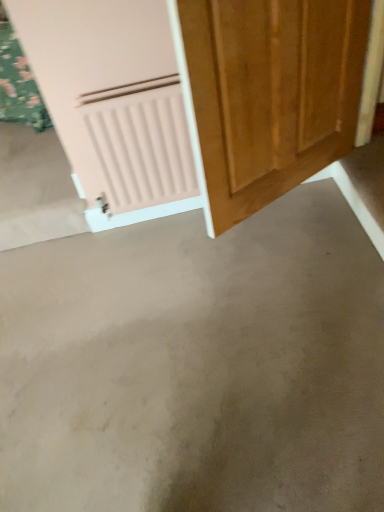
Describe the element at coordinates (196, 365) in the screenshot. This screenshot has height=512, width=384. I see `gray concrete at center` at that location.

Locate an element on the screen. The height and width of the screenshot is (512, 384). gray concrete at center is located at coordinates (196, 365).

The width and height of the screenshot is (384, 512). Find the location of `wooden door at center`. wooden door at center is located at coordinates (91, 58).

Describe the element at coordinates (91, 58) in the screenshot. I see `wooden door at center` at that location.

Identify the location of gray concrete at center. (196, 365).

Can you confirm if gray concrete at center is positioned to the right of wooden door at center?

No, gray concrete at center is not to the right of wooden door at center.

Which is behind, gray concrete at center or wooden door at center?

Positioned behind is gray concrete at center.

Does point (102, 430) come in front of point (82, 177)?

Yes, point (102, 430) is in front of point (82, 177).

From the image's perspective, is gray concrete at center above wooden door at center?

Actually, gray concrete at center appears below wooden door at center in the image.

From a real-world perspective, between gray concrete at center and wooden door at center, who is vertically lower?

gray concrete at center, from a real-world perspective.

Looking at this image, considering the sizes of objects gray concrete at center and wooden door at center in the image provided, who is thinner, gray concrete at center or wooden door at center?

Thinner between the two is wooden door at center.

Between gray concrete at center and wooden door at center, which one has less height?

gray concrete at center.

Looking at the image, does gray concrete at center seem bigger or smaller compared to wooden door at center?

gray concrete at center is bigger than wooden door at center.

From the picture: Is wooden door at center a part of gray concrete at center?

No, wooden door at center is located outside of gray concrete at center.

Is gray concrete at center touching wooden door at center?

gray concrete at center and wooden door at center are clearly separated.

Is gray concrete at center turned away from wooden door at center?

No, gray concrete at center's orientation is not away from wooden door at center.

In order to click on door located above the gray concrete at center (from the image's perspective) in this screenshot , I will do tap(91, 58).

Does wooden door at center appear on the left side of gray concrete at center?

No.

Considering the positions of objects wooden door at center and gray concrete at center in the image provided, who is in front, wooden door at center or gray concrete at center?

wooden door at center is more forward.

Considering the points (52, 57) and (309, 398), which point is behind, point (52, 57) or point (309, 398)?

The point (52, 57) is farther.

Based on the photo, from the image's perspective, which object appears higher, wooden door at center or gray concrete at center?

wooden door at center, from the image's perspective.

From a real-world perspective, between wooden door at center and gray concrete at center, who is vertically lower?

→ In real-world perspective, gray concrete at center is lower.

Is wooden door at center thinner than gray concrete at center?

Yes, wooden door at center is thinner than gray concrete at center.

From the picture: In terms of height, does wooden door at center look taller or shorter compared to gray concrete at center?

Considering their sizes, wooden door at center has more height than gray concrete at center.

Considering the sizes of objects wooden door at center and gray concrete at center in the image provided, who is smaller, wooden door at center or gray concrete at center?

Smaller between the two is wooden door at center.

Do you think wooden door at center is within gray concrete at center, or outside of it?

wooden door at center is located beyond the bounds of gray concrete at center.

Is wooden door at center far away from gray concrete at center?

That's not correct — wooden door at center is a little close to gray concrete at center.

Is wooden door at center looking in the opposite direction of gray concrete at center?

That's not correct — wooden door at center is not looking away from gray concrete at center.

At what (x,y) coordinates should I click in order to perform the action: click on concrete behind the wooden door at center. Please return your answer as a coordinate pair (x, y). Looking at the image, I should click on (196, 365).

Where is `door in front of the gray concrete at center`? door in front of the gray concrete at center is located at coordinates (91, 58).

Image resolution: width=384 pixels, height=512 pixels. In order to click on concrete to the left of wooden door at center in this screenshot , I will do `click(196, 365)`.